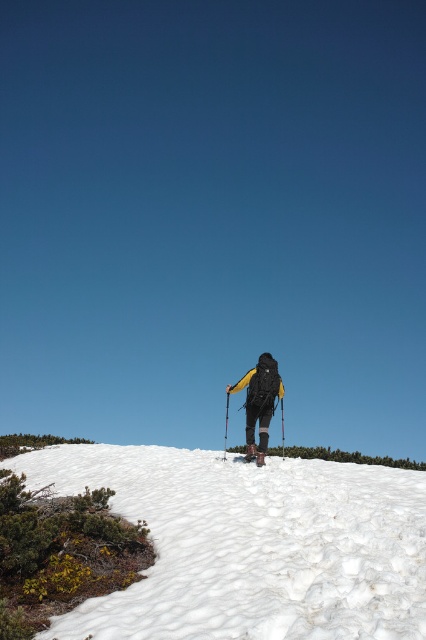
Question: Can you confirm if white fluffy snow at center is positioned above black plastic ski pole at center?

Choices:
 (A) no
 (B) yes

Answer: (A)

Question: Which point is farther from the camera taking this photo?

Choices:
 (A) (264, 440)
 (B) (282, 456)
 (C) (423, 614)

Answer: (B)

Question: Estimate the real-world distances between objects in this image. Which object is closer to the black matte ski pole at center?

Choices:
 (A) white fluffy snow at center
 (B) black plastic ski pole at center
 (C) matte black backpack at center

Answer: (C)

Question: Is matte black backpack at center to the left of black matte ski pole at center from the viewer's perspective?

Choices:
 (A) no
 (B) yes

Answer: (A)

Question: Which of the following is the farthest from the observer?

Choices:
 (A) (167, 480)
 (B) (264, 435)
 (C) (282, 410)

Answer: (C)

Question: Is white fluffy snow at center smaller than black plastic ski pole at center?

Choices:
 (A) no
 (B) yes

Answer: (B)